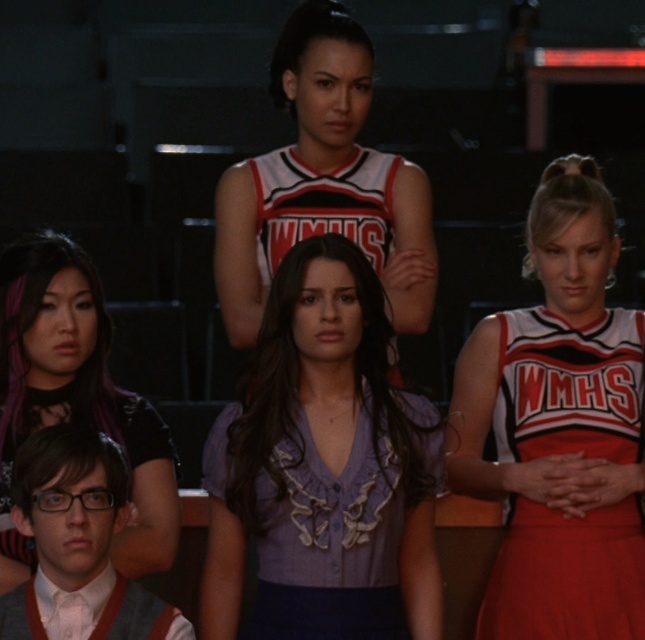
You are a photographer positioned in the gymnasium and want to capture a clear photo of both the red fabric cheerleader uniform at center and the white jersey at center. Which one will appear larger in the photo?

The red fabric cheerleader uniform at center will appear larger in the photo because it is closer to the viewer than the white jersey at center.

Consider the image. You are standing in the gymnasium and want to take a photo of the point at coordinates (x=55, y=236). Your camera has a focal length of 50mm and you are currently 4 meters away from the point. Should you move closer or farther away to focus properly?

The distance of point (x=55, y=236) from camera is 4.39 meters. Since you are currently 4 meters away, you need to move slightly farther away to match the 4.39 meter distance for proper focus.

Based on the scene description, where is the shiny purple hair at lower left positioned relative to the other objects in the image?

The shiny purple hair at lower left is located at point (74, 397) in the image coordinates.